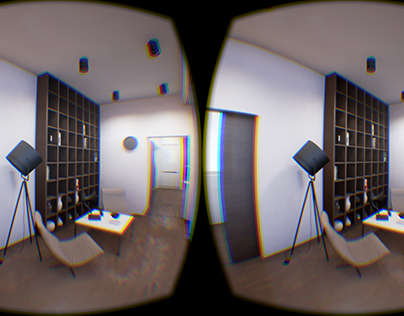
This screenshot has height=316, width=404. Find the location of `lamp legs`. lamp legs is located at coordinates (304, 198), (312, 194), (25, 197), (18, 198).